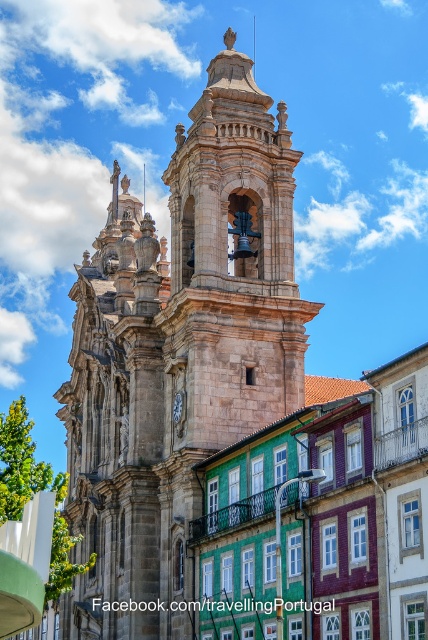
You are standing in the square in front of the brown stone tower at center and the white wooden clock at center. Which object is closer to you?

The brown stone tower at center is closer to you because it is in front of the white wooden clock at center.

You are a tourist standing in front of the historic church and its adjacent buildings. You notice the brown stone tower at center and the white wooden clock at center. Which object is positioned higher in the scene?

The brown stone tower at center is positioned higher than the white wooden clock at center according to the description.